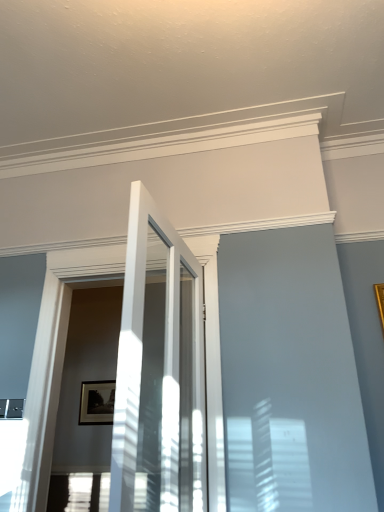
In order to click on white glossy door at center in this screenshot , I will do `click(159, 371)`.

This screenshot has width=384, height=512. Describe the element at coordinates (159, 371) in the screenshot. I see `white glossy door at center` at that location.

Measure the distance between white glossy door at center and camera.

white glossy door at center is 3.64 feet from camera.

This screenshot has height=512, width=384. Describe the element at coordinates (97, 403) in the screenshot. I see `matte black picture frame at center` at that location.

Identify the location of matte black picture frame at center. (97, 403).

The image size is (384, 512). Find the location of `white glossy door at center`. white glossy door at center is located at coordinates (159, 371).

Considering the relative positions of white glossy door at center and matte black picture frame at center in the image provided, is white glossy door at center to the right of matte black picture frame at center from the viewer's perspective?

Yes, white glossy door at center is to the right of matte black picture frame at center.

Is white glossy door at center positioned before matte black picture frame at center?

Yes, the depth of white glossy door at center is less than that of matte black picture frame at center.

Considering the positions of point (192, 500) and point (86, 386), is point (192, 500) closer or farther from the camera than point (86, 386)?

Point (192, 500).

From the image's perspective, is white glossy door at center below matte black picture frame at center?

No.

From a real-world perspective, relative to matte black picture frame at center, is white glossy door at center vertically above or below?

white glossy door at center is below matte black picture frame at center.

Between white glossy door at center and matte black picture frame at center, which one has larger width?

Wider between the two is white glossy door at center.

Which of these two, white glossy door at center or matte black picture frame at center, stands shorter?

matte black picture frame at center.

In terms of size, does white glossy door at center appear bigger or smaller than matte black picture frame at center?

In the image, white glossy door at center appears to be larger than matte black picture frame at center.

Is white glossy door at center positioned beyond the bounds of matte black picture frame at center?

white glossy door at center is positioned outside matte black picture frame at center.

Is white glossy door at center far from matte black picture frame at center?

Yes, white glossy door at center is far from matte black picture frame at center.

Could you tell me if white glossy door at center is facing matte black picture frame at center?

No.

I want to click on picture frame on the left of white glossy door at center, so click(97, 403).

Which object is positioned more to the left, matte black picture frame at center or white glossy door at center?

Positioned to the left is matte black picture frame at center.

Is matte black picture frame at center in front of or behind white glossy door at center in the image?

Visually, matte black picture frame at center is located behind white glossy door at center.

Considering the positions of point (114, 394) and point (141, 346), is point (114, 394) closer or farther from the camera than point (141, 346)?

Point (114, 394).

From the image's perspective, is matte black picture frame at center over white glossy door at center?

No, from the image's perspective, matte black picture frame at center is not over white glossy door at center.

From a real-world perspective, who is located higher, matte black picture frame at center or white glossy door at center?

In real-world perspective, matte black picture frame at center is above.

Which object is thinner, matte black picture frame at center or white glossy door at center?

matte black picture frame at center.

Is matte black picture frame at center taller than white glossy door at center?

No.

Between matte black picture frame at center and white glossy door at center, which one has smaller size?

With smaller size is matte black picture frame at center.

Would you say matte black picture frame at center contains white glossy door at center?

No.

Are matte black picture frame at center and white glossy door at center making contact?

No, matte black picture frame at center is not beside white glossy door at center.

Is matte black picture frame at center looking in the opposite direction of white glossy door at center?

matte black picture frame at center does not have its back to white glossy door at center.

How many degrees apart are the facing directions of matte black picture frame at center and white glossy door at center?

3.64 degrees separate the facing orientations of matte black picture frame at center and white glossy door at center.

In order to click on door located in front of the matte black picture frame at center in this screenshot , I will do `click(159, 371)`.

Locate an element on the screen. picture frame above the white glossy door at center (from a real-world perspective) is located at coordinates (97, 403).

Locate an element on the screen. This screenshot has width=384, height=512. door located underneath the matte black picture frame at center (from a real-world perspective) is located at coordinates (159, 371).